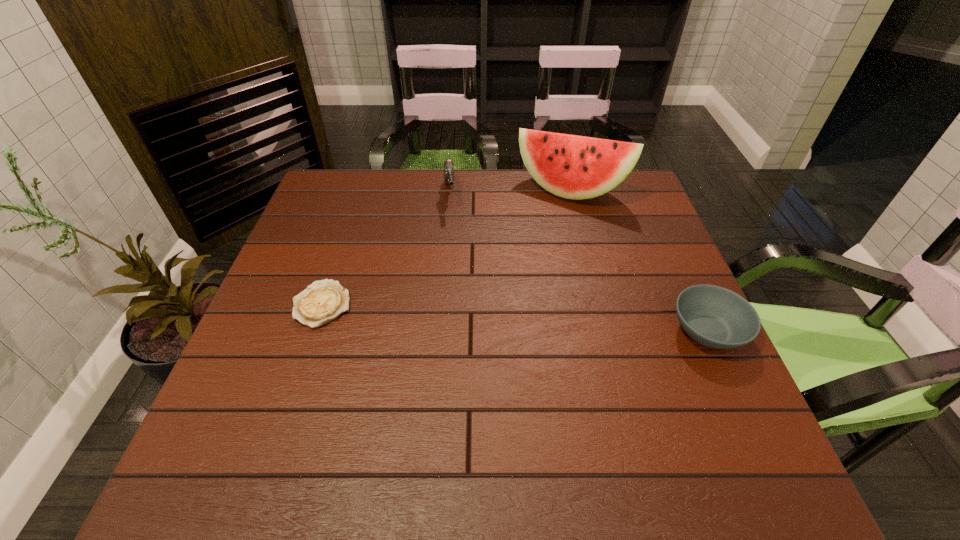
Locate an element on the screen. The width and height of the screenshot is (960, 540). vacant region located at the barrel of the third object from right to left is located at coordinates (452, 241).

Where is `blank space located 0.140m on the outer rind of the watermelon`? blank space located 0.140m on the outer rind of the watermelon is located at coordinates (542, 238).

At what (x,y) coordinates should I click in order to perform the action: click on free point located 0.180m on the outer rind of the watermelon. Please return your answer as a coordinate pair (x, y). Image resolution: width=960 pixels, height=540 pixels. Looking at the image, I should click on (539, 247).

Locate an element on the screen. This screenshot has height=540, width=960. vacant space located on the outer rind of the watermelon is located at coordinates (529, 268).

Find the location of a particular element. Image resolution: width=960 pixels, height=540 pixels. pistol located at the far edge is located at coordinates 449,170.

Locate an element on the screen. This screenshot has width=960, height=540. watermelon that is positioned at the far edge is located at coordinates (575, 167).

Where is `object located at the left edge`? The height and width of the screenshot is (540, 960). object located at the left edge is located at coordinates (323, 301).

Locate an element on the screen. The image size is (960, 540). soup bowl positioned at the right edge is located at coordinates (713, 316).

Identify the location of watermelon that is at the right edge. This screenshot has width=960, height=540. (575, 167).

The image size is (960, 540). I want to click on object located in the far right corner section of the desktop, so click(x=575, y=167).